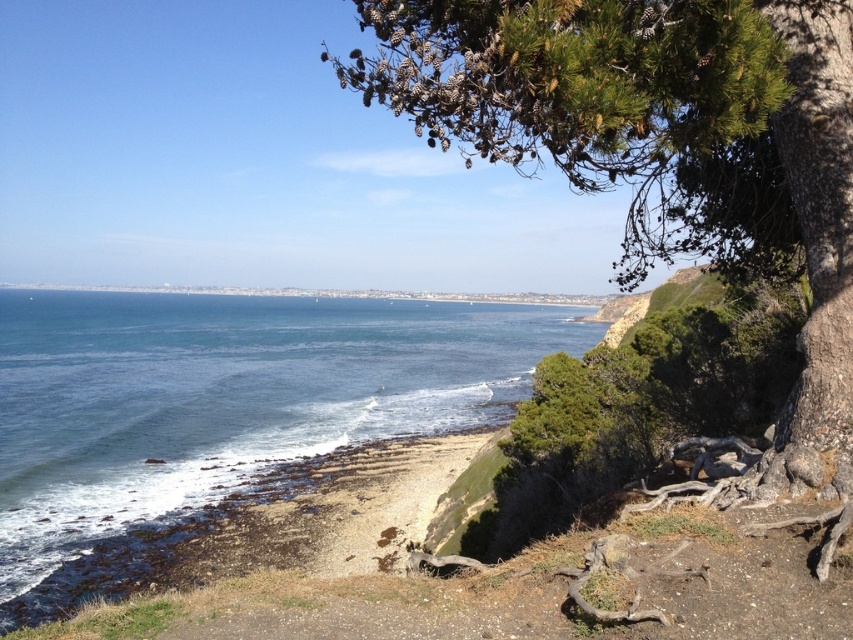
Question: Is green pinecone-covered tree at upper right to the right of blue water at center from the viewer's perspective?

Choices:
 (A) yes
 (B) no

Answer: (B)

Question: Which of the following is the closest to the observer?

Choices:
 (A) (790, 125)
 (B) (482, 314)

Answer: (A)

Question: Is green pinecone-covered tree at upper right further to camera compared to blue water at center?

Choices:
 (A) yes
 (B) no

Answer: (B)

Question: Which point is farther to the camera?

Choices:
 (A) green pinecone-covered tree at upper right
 (B) blue water at center

Answer: (B)

Question: Can you confirm if green pinecone-covered tree at upper right is wider than blue water at center?

Choices:
 (A) no
 (B) yes

Answer: (A)